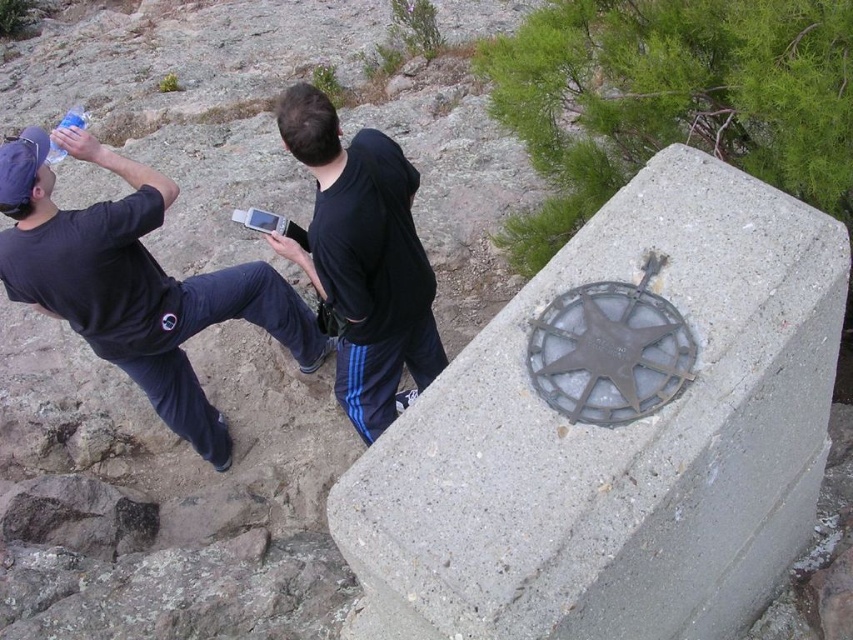
You are taking a photo of the two points mentioned. Which point, point (x=463, y=573) or point (x=372, y=428), will appear larger in your camera view?

Point (x=463, y=573) is closer to the camera than point (x=372, y=428), so it will appear larger in the camera view.

You are a drone operator trying to capture a photo of the black matte hoodie at center. The drone is currently hovering at point (x=363, y=259). Is the drone positioned directly above the black matte hoodie at center?

Yes, the drone is positioned directly above the black matte hoodie at center because the point (x=363, y=259) is where the black matte hoodie at center is located.